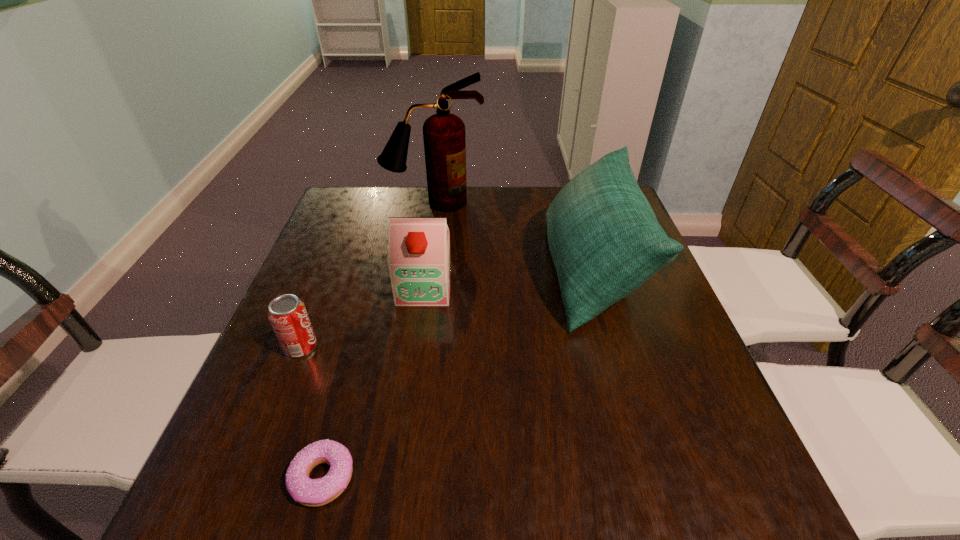
What are the coordinates of `object that ranks as the third closest to the cushion` in the screenshot? It's located at (310, 492).

Locate which object ranks third in proximity to the cushion. Please provide its 2D coordinates. Your answer should be formatted as a tuple, i.e. [(x, y)], where the tuple contains the x and y coordinates of a point satisfying the conditions above.

[(310, 492)]

Where is `free region that satisfies the following two spatial constraints: 1. on the front-facing side of the rightmost object; 2. on the front side of the nearest object`? The height and width of the screenshot is (540, 960). free region that satisfies the following two spatial constraints: 1. on the front-facing side of the rightmost object; 2. on the front side of the nearest object is located at coordinates (652, 477).

Identify the location of vacant space that satisfies the following two spatial constraints: 1. on the front side of the leftmost object; 2. on the left side of the nearest object. This screenshot has width=960, height=540. (250, 477).

Locate an element on the screen. This screenshot has width=960, height=540. free location that satisfies the following two spatial constraints: 1. on the front-facing side of the rightmost object; 2. on the front side of the doughnut is located at coordinates (652, 477).